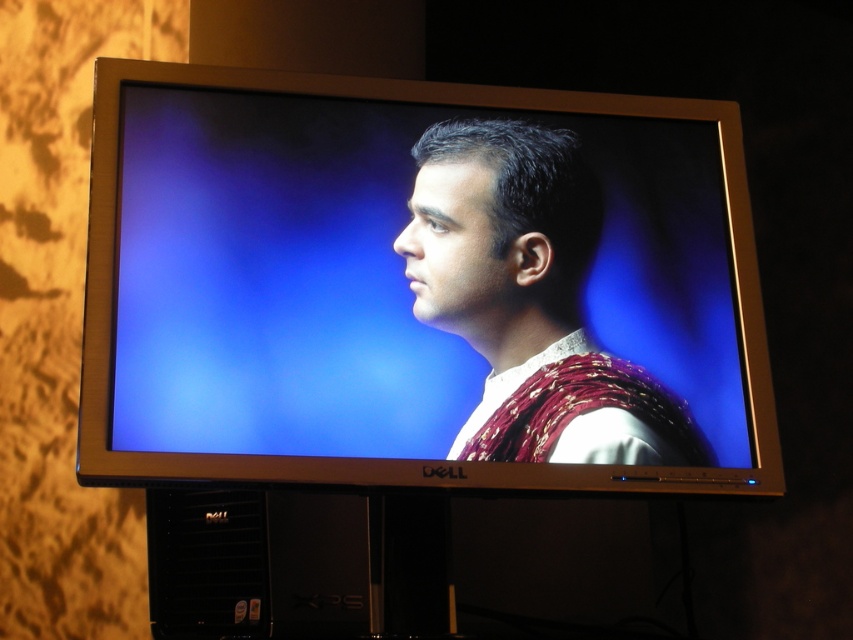
You are setting up a display and need to arrange the satin silver monitor at center and the matte purple fabric at center. According to the image, which object is placed to the left of the other?

The satin silver monitor at center is positioned on the left side of matte purple fabric at center, so the monitor is to the left of the fabric.

You are an IT technician and need to locate the monitor in the image. According to the coordinates provided, where exactly is the satin silver monitor at center located?

The satin silver monitor at center is located at point (418, 288).